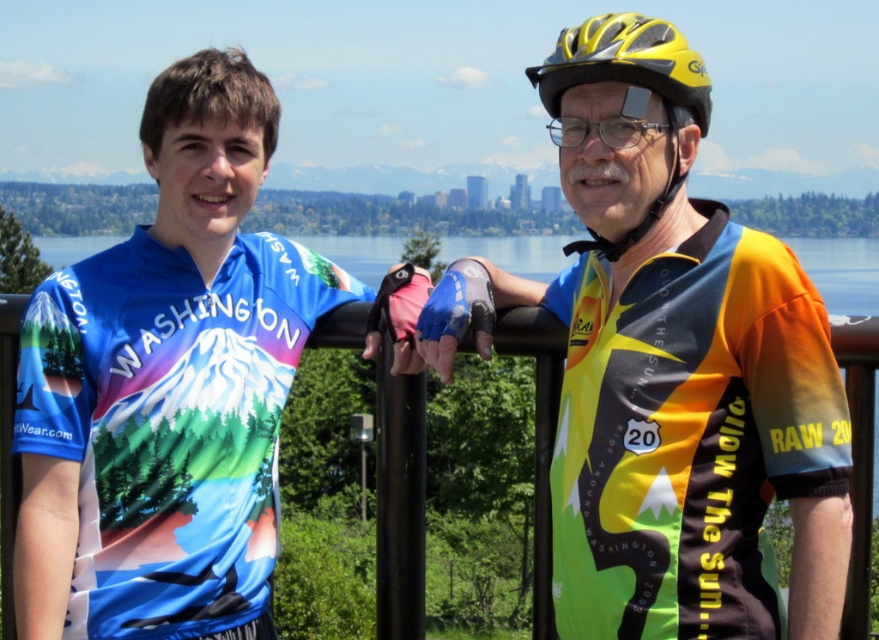
You are a photographer trying to capture a clear shot of both the blue jersey at left and the transparent plastic goggles at upper center. Considering their sizes, which object should you focus on first to ensure it fits entirely within your camera frame?

The blue jersey at left is wider than the transparent plastic goggles at upper center, so you should focus on the blue jersey at left first to ensure it fits entirely within your camera frame.

You are a photographer standing at the origin point in the image. There is a blue jersey at left represented by point (166, 387). Can you tell me the coordinates of the blue jersey at left?

The coordinates of the blue jersey at left are point (166, 387).

You are a photographer trying to capture a clear shot of the transparent plastic goggles at upper center. However, the yellow matte bicycle helmet at upper center is blocking your view. Can you adjust your angle to see the goggles without moving the helmet?

The yellow matte bicycle helmet at upper center is above the transparent plastic goggles at upper center, so you can lower your angle to see the goggles below the helmet.